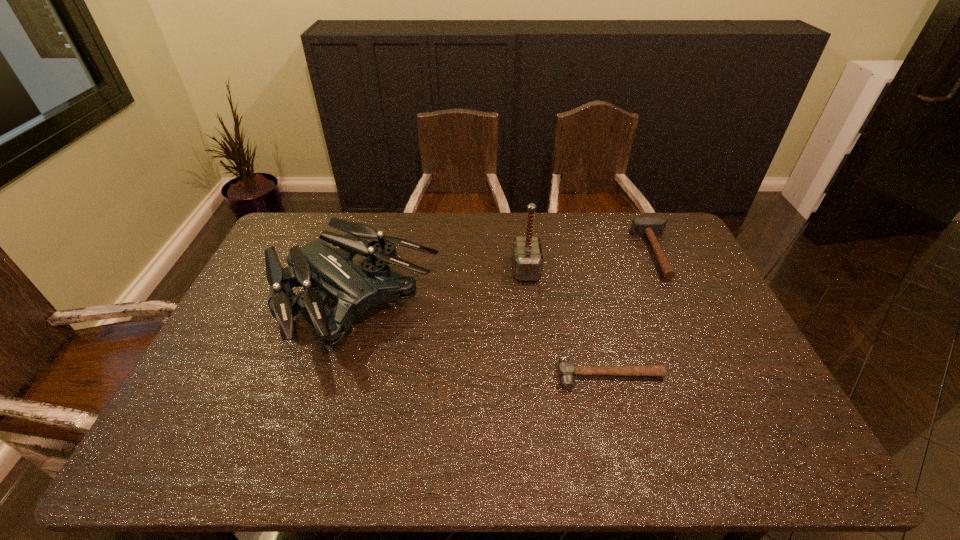
Locate an element on the screen. This screenshot has height=540, width=960. vacant space situated 0.170m on the striking surface of the second tallest hammer is located at coordinates (592, 253).

At what (x,y) coordinates should I click in order to perform the action: click on free space located on the striking surface of the second tallest hammer. Please return your answer as a coordinate pair (x, y). Image resolution: width=960 pixels, height=540 pixels. Looking at the image, I should click on (614, 253).

Where is `free location located 0.130m on the striking surface of the second tallest hammer`? free location located 0.130m on the striking surface of the second tallest hammer is located at coordinates (604, 253).

Where is `free spot located 0.080m on the striking face of the shortest object`? free spot located 0.080m on the striking face of the shortest object is located at coordinates (622, 419).

You are a GUI agent. You are given a task and a screenshot of the screen. Output one action in this format:
    pyautogui.click(x=<x>, y=<y>)
    Task: Click on the object situated at the far edge
    
    Given the screenshot: What is the action you would take?
    pyautogui.click(x=651, y=227)

I want to click on object located in the left edge section of the desktop, so click(327, 263).

Locate an element on the screen. This screenshot has width=960, height=540. object at the right edge is located at coordinates (651, 227).

The height and width of the screenshot is (540, 960). I want to click on object present at the far right corner, so click(651, 227).

The height and width of the screenshot is (540, 960). Find the location of `vacant space at the far edge of the desktop`. vacant space at the far edge of the desktop is located at coordinates (627, 222).

Locate an element on the screen. vacant region at the near edge of the desktop is located at coordinates (246, 433).